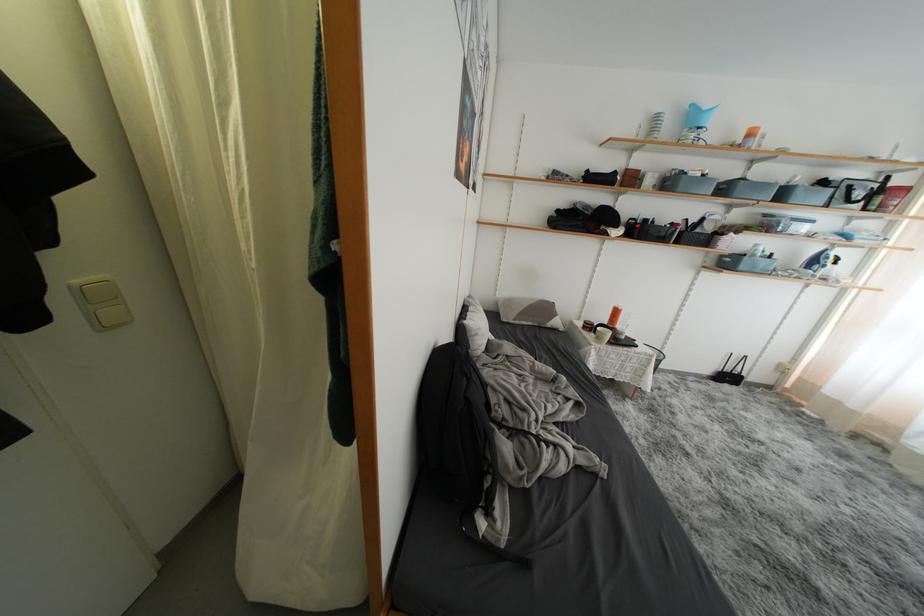
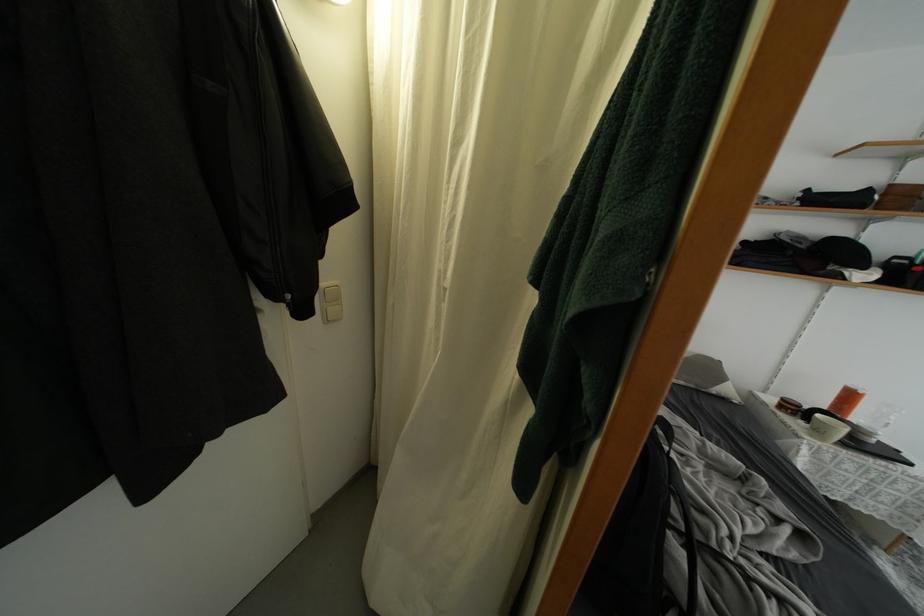
Where in the second image is the point corresponding to (570,382) from the first image?

(769, 485)